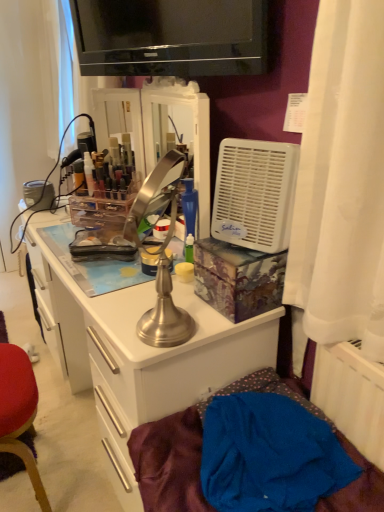
At what (x,y) coordinates should I click in order to perform the action: click on free space that is to the left of brushed metal table lamp at center. Please return your answer as a coordinate pair (x, y). The width and height of the screenshot is (384, 512). Looking at the image, I should click on (112, 318).